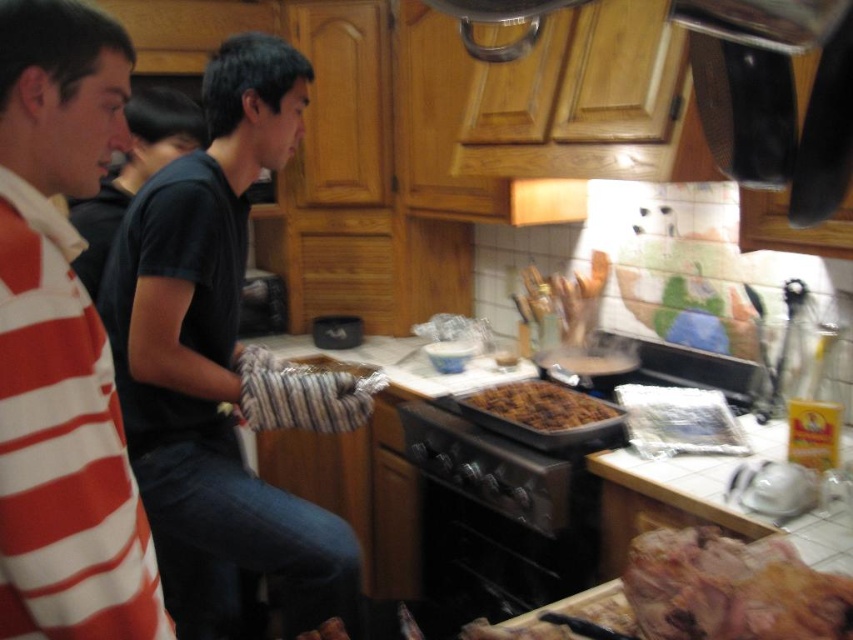
You are a chef in the kitchen and need to retrieve the brown crispy meat at lower right from the counter. The oven is in the way. Which direction should you move around the black matte oven at center to reach it?

The brown crispy meat at lower right is positioned on the right side of the black matte oven at center. To reach it, move around the right side of the oven.

You are trying to determine which appliance is taller between the black metal stove at center and the black matte oven at center in the kitchen. Based on their positions, which one is taller?

The black matte oven at center is taller than the black metal stove at center because the black metal stove at center is not as tall as the black matte oven at center.

You are a chef in a busy kitchen and need to quickly access both the black metal stove at center and the black matte oven at center. Given their proximity, could you reach both appliances without moving your position?

The black metal stove at center is only 16.93 centimeters away from the black matte oven at center, so yes, you can easily reach both appliances without moving your position since they are positioned very close to each other.